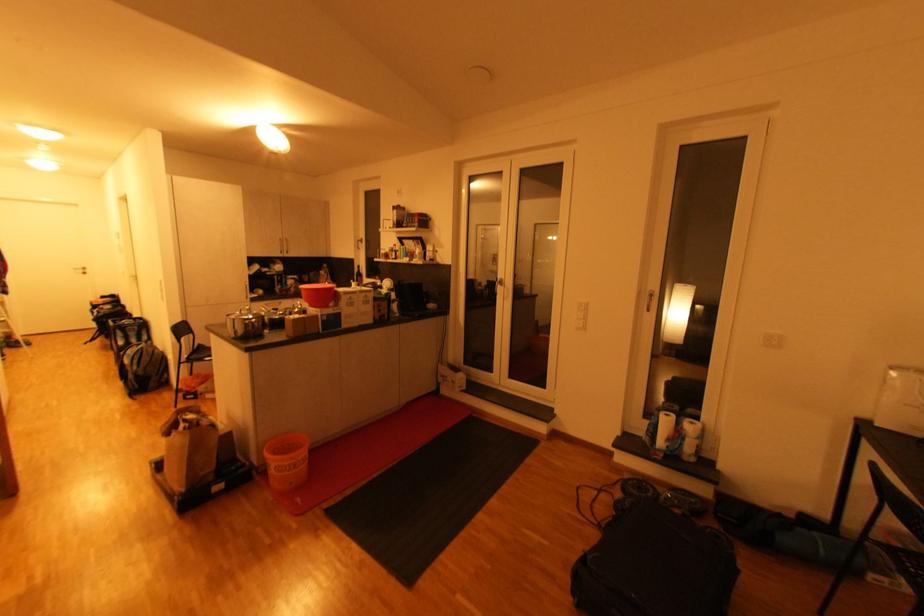
Identify the location of dark glass bottle. (359, 276).